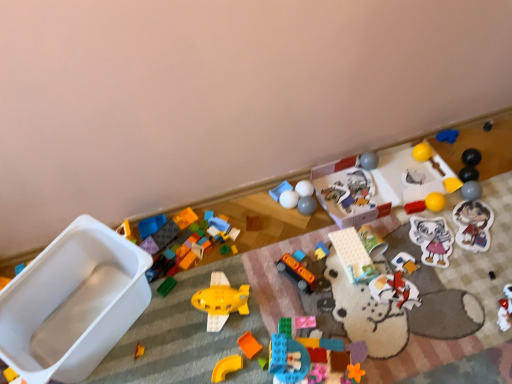
You are a GUI agent. You are given a task and a screenshot of the screen. Output one action in this format:
    pyautogui.click(x=<x>, y=<y>)
    Task: Click on the vacant area that is in front of rubber duck at center, which ranks as the eleventh toy in right-to-left order
    
    Given the screenshot: What is the action you would take?
    pyautogui.click(x=332, y=297)